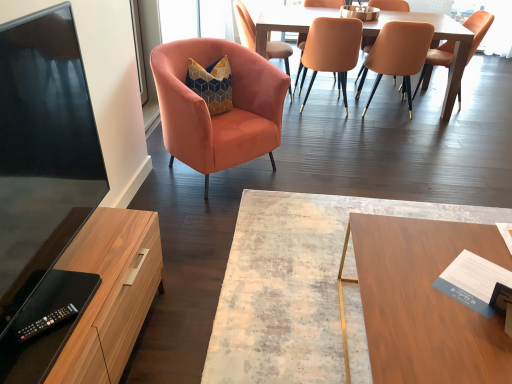
In order to click on vacant region to the left of wooden desk at center in this screenshot , I will do `click(273, 311)`.